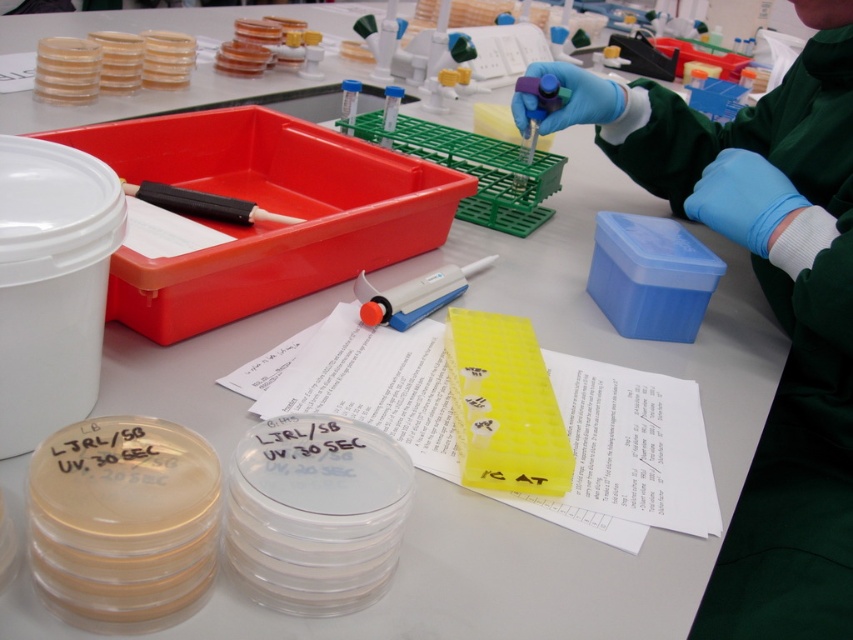
Consider the image. You are a lab assistant who needs to use the white plastic pipette at center to transfer a solution. However, you notice the blue latex glove at upper right is in the way. Can you move the pipette to the left to avoid the glove?

The blue latex glove at upper right is positioned on the right side of white plastic pipette at center, so moving the pipette to the left would allow it to avoid the glove.